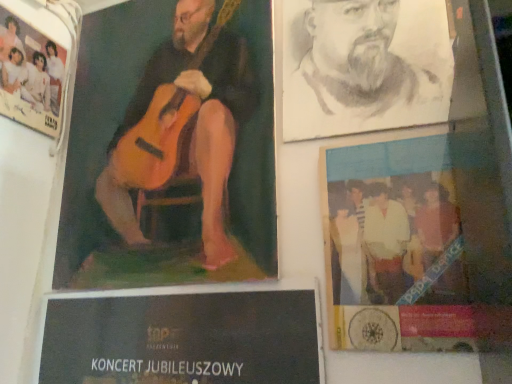
Question: Is charcoal portrait of man at upper right shorter than blue glossy poster at lower right, which ranks as the 1th poster in right-to-left order?

Choices:
 (A) yes
 (B) no

Answer: (A)

Question: Is charcoal portrait of man at upper right thinner than blue glossy poster at lower right, which ranks as the 1th poster in right-to-left order?

Choices:
 (A) yes
 (B) no

Answer: (B)

Question: Is the depth of charcoal portrait of man at upper right less than that of blue glossy poster at lower right, which ranks as the 1th poster in right-to-left order?

Choices:
 (A) no
 (B) yes

Answer: (A)

Question: Does charcoal portrait of man at upper right have a smaller size compared to blue glossy poster at lower right, which ranks as the 3th poster in left-to-right order?

Choices:
 (A) no
 (B) yes

Answer: (A)

Question: From the image's perspective, is charcoal portrait of man at upper right located beneath blue glossy poster at lower right, which ranks as the 1th poster in right-to-left order?

Choices:
 (A) yes
 (B) no

Answer: (B)

Question: From a real-world perspective, is charcoal portrait of man at upper right under blue glossy poster at lower right, which ranks as the 1th poster in right-to-left order?

Choices:
 (A) yes
 (B) no

Answer: (B)

Question: From a real-world perspective, is charcoal portrait of man at upper right physically above white paper poster at upper left, acting as the 3th poster starting from the right?

Choices:
 (A) yes
 (B) no

Answer: (B)

Question: Considering the relative sizes of charcoal portrait of man at upper right and white paper poster at upper left, arranged as the first poster when viewed from the left, in the image provided, is charcoal portrait of man at upper right bigger than white paper poster at upper left, arranged as the first poster when viewed from the left,?

Choices:
 (A) no
 (B) yes

Answer: (B)

Question: Is charcoal portrait of man at upper right next to white paper poster at upper left, arranged as the first poster when viewed from the left, and touching it?

Choices:
 (A) yes
 (B) no

Answer: (B)

Question: Considering the relative sizes of charcoal portrait of man at upper right and white paper poster at upper left, arranged as the first poster when viewed from the left, in the image provided, is charcoal portrait of man at upper right wider than white paper poster at upper left, arranged as the first poster when viewed from the left,?

Choices:
 (A) yes
 (B) no

Answer: (A)

Question: Is charcoal portrait of man at upper right behind white paper poster at upper left, acting as the 3th poster starting from the right?

Choices:
 (A) no
 (B) yes

Answer: (A)

Question: Is charcoal portrait of man at upper right aimed at white paper poster at upper left, acting as the 3th poster starting from the right?

Choices:
 (A) no
 (B) yes

Answer: (A)

Question: Are wooden guitar at upper left, the 2th poster in the right-to-left sequence, and blue glossy poster at lower right, which ranks as the 1th poster in right-to-left order, far apart?

Choices:
 (A) no
 (B) yes

Answer: (A)